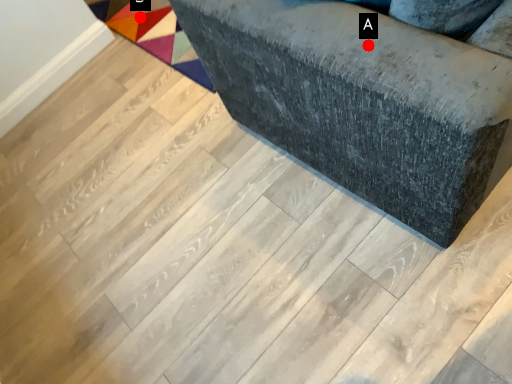
Question: Two points are circled on the image, labeled by A and B beside each circle. Which point is farther from the camera taking this photo?

Choices:
 (A) A is further
 (B) B is further

Answer: (B)